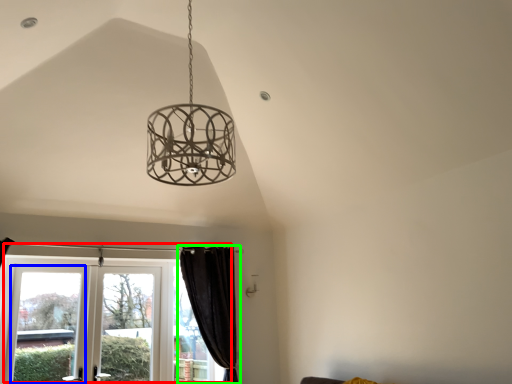
Question: Which object is the farthest from window (highlighted by a red box)? Choose among these: window (highlighted by a blue box) or curtain (highlighted by a green box).

Choices:
 (A) window
 (B) curtain

Answer: (B)